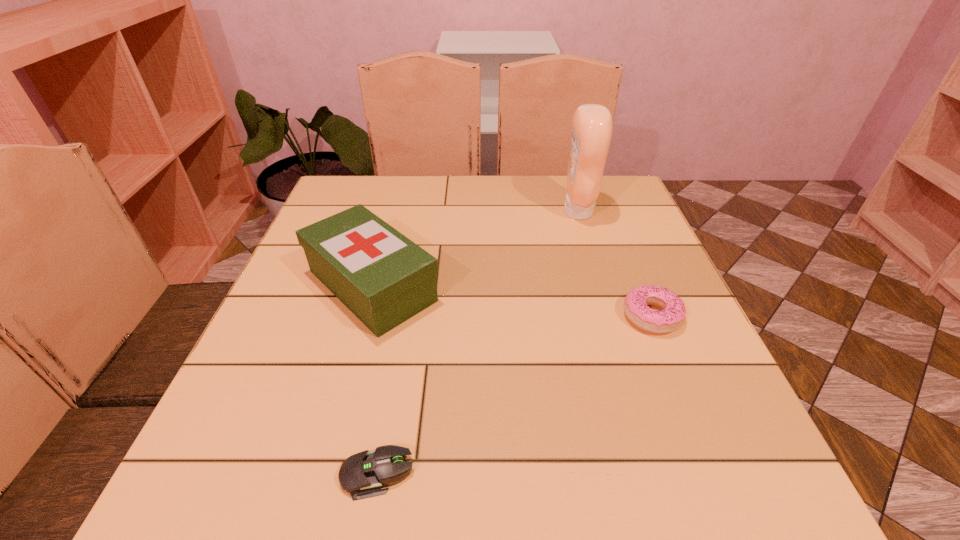
In the image, there is a desktop. Identify the location of vacant space at the left edge. (328, 329).

In order to click on blank space at the right edge of the desktop in this screenshot , I will do `click(665, 261)`.

In the image, there is a desktop. In order to click on free region at the far left corner in this screenshot , I will do `click(371, 177)`.

Locate an element on the screen. This screenshot has width=960, height=540. vacant space at the far right corner is located at coordinates (626, 208).

Where is `free space at the near right corner`? The height and width of the screenshot is (540, 960). free space at the near right corner is located at coordinates (767, 483).

Locate an element on the screen. vacant area that lies between the computer mouse and the third shortest object is located at coordinates (374, 380).

Locate an element on the screen. vacant area that lies between the third tallest object and the second tallest object is located at coordinates (512, 301).

You are a GUI agent. You are given a task and a screenshot of the screen. Output one action in this format:
    pyautogui.click(x=<x>, y=<y>)
    Task: Click on the vacant area that lies between the doughnut and the tallest object
    This screenshot has width=960, height=540.
    Given the screenshot: What is the action you would take?
    pyautogui.click(x=614, y=264)

Where is `vacant space in between the first-aid kit and the condiment`? The width and height of the screenshot is (960, 540). vacant space in between the first-aid kit and the condiment is located at coordinates (475, 248).

Image resolution: width=960 pixels, height=540 pixels. What are the coordinates of `vacant space that is in between the doughnut and the computer mouse` in the screenshot? It's located at (515, 395).